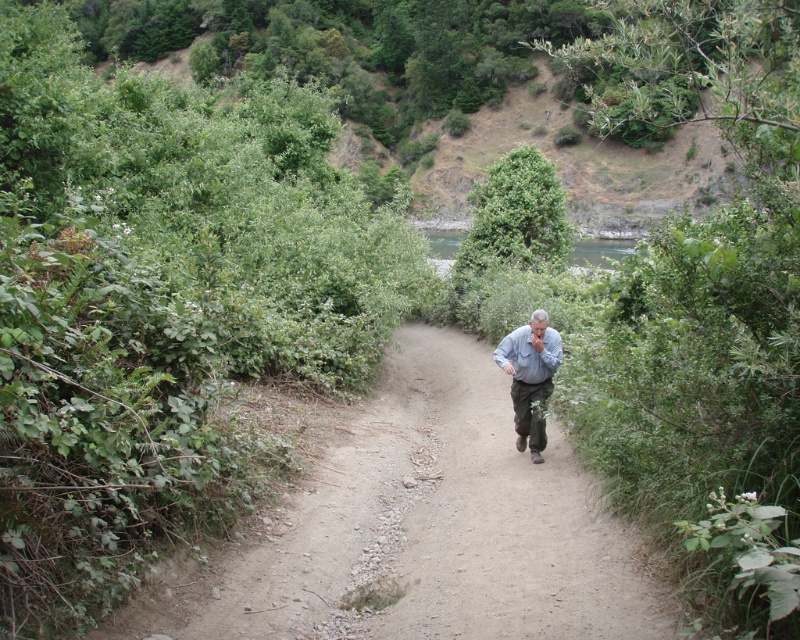
Based on the photo, you are standing at the center of the dirt path at center and looking towards the gray fabric shirt at center. Which object is closer to you?

The dirt path at center is closer to you than the gray fabric shirt at center.

You are standing at the center of the dirt path at center and looking towards the gray fabric shirt at center. Which object is closer to your feet?

The dirt path at center is closer to your feet because it is located below the gray fabric shirt at center.

You are standing at the starting point of the dirt path at center. The path curves gently to the right and leads towards a body of water in the background. If you follow the path straight ahead without turning, will you eventually reach the water?

Yes, following the dirt path at center straight ahead will lead you towards the body of water in the background as described in the scene.